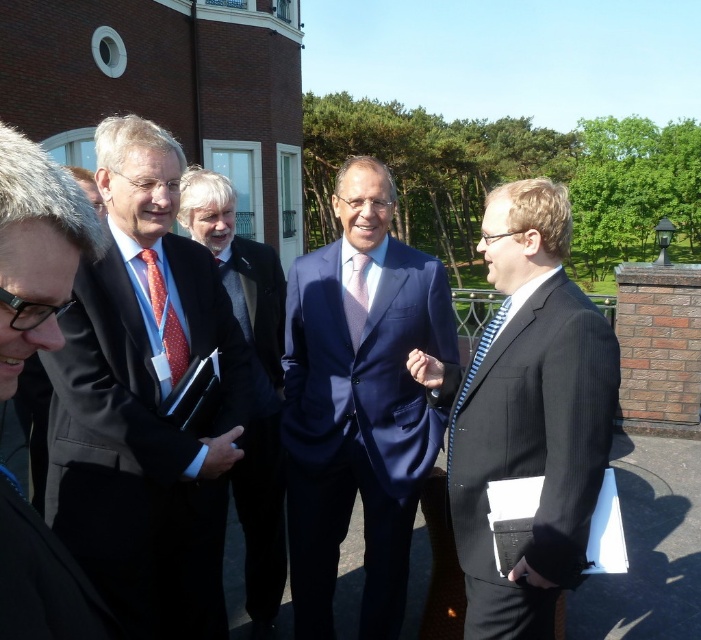
You are attending a formal event and notice two men dressed in formal attire. One is wearing a black pinstripe suit at center and the other a matte red tie at center. Based on the scene description, which man is positioned to the right of the other?

The black pinstripe suit at center is positioned to the right of the matte red tie at center, so the man in the black pinstripe suit is to the right of the one with the matte red tie.

You are organizing a photo shoot and need to ensure that the black pinstripe suit at center and the matte red tie at center are visible in the frame. Based on their positions, which one is closer to the bottom of the image?

The black pinstripe suit at center is positioned under the matte red tie at center, so it is closer to the bottom of the image.